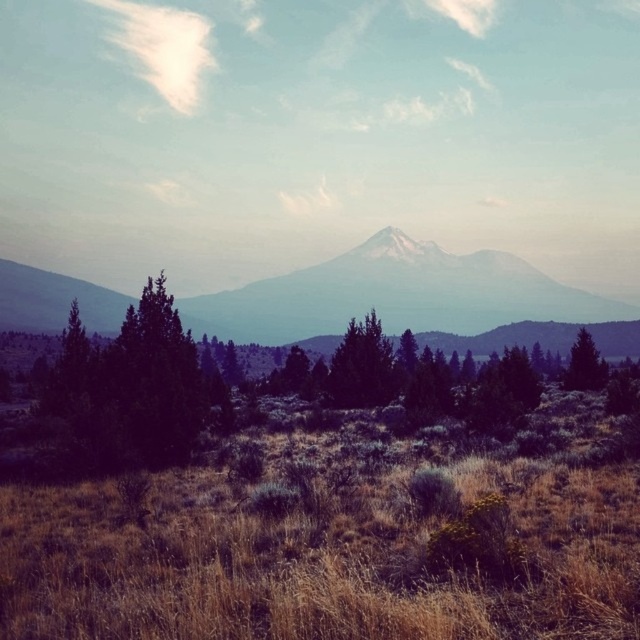
Question: Which point is closer to the camera?

Choices:
 (A) brown dry grass at center
 (B) green matte tree at right

Answer: (A)

Question: Is brown dry grass at center further to the viewer compared to dark green textured tree at center?

Choices:
 (A) yes
 (B) no

Answer: (B)

Question: Which object is positioned farthest from the distant gray mountain at center?

Choices:
 (A) brown dry grass at center
 (B) dark green textured tree at center

Answer: (A)

Question: Can you confirm if distant gray mountain at center is positioned below dark green textured tree at center?

Choices:
 (A) no
 (B) yes

Answer: (A)

Question: Which point is farther from the camera taking this photo?

Choices:
 (A) (593, 376)
 (B) (65, 362)
 (C) (220, 538)
 (D) (22, 273)

Answer: (D)

Question: Is brown dry grass at center wider than distant gray mountain at center?

Choices:
 (A) no
 (B) yes

Answer: (A)